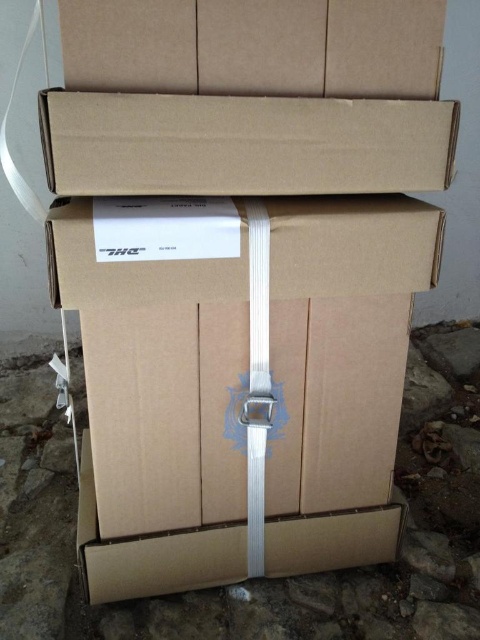
Can you confirm if brown cardboard box at center is shorter than brown cardboard box at upper center?

No.

Describe the element at coordinates (250, 390) in the screenshot. This screenshot has height=640, width=480. I see `brown cardboard box at center` at that location.

Locate an element on the screen. brown cardboard box at center is located at coordinates (250, 390).